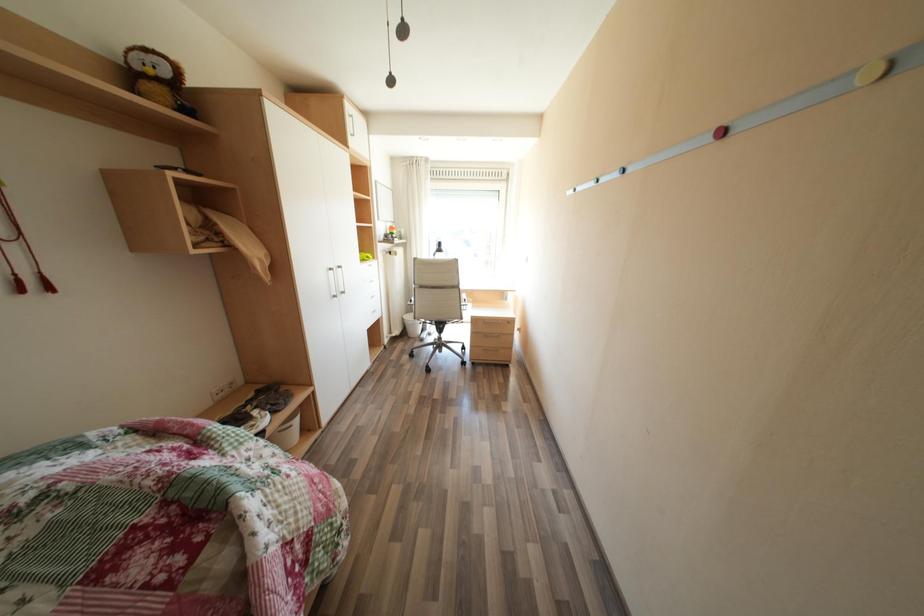
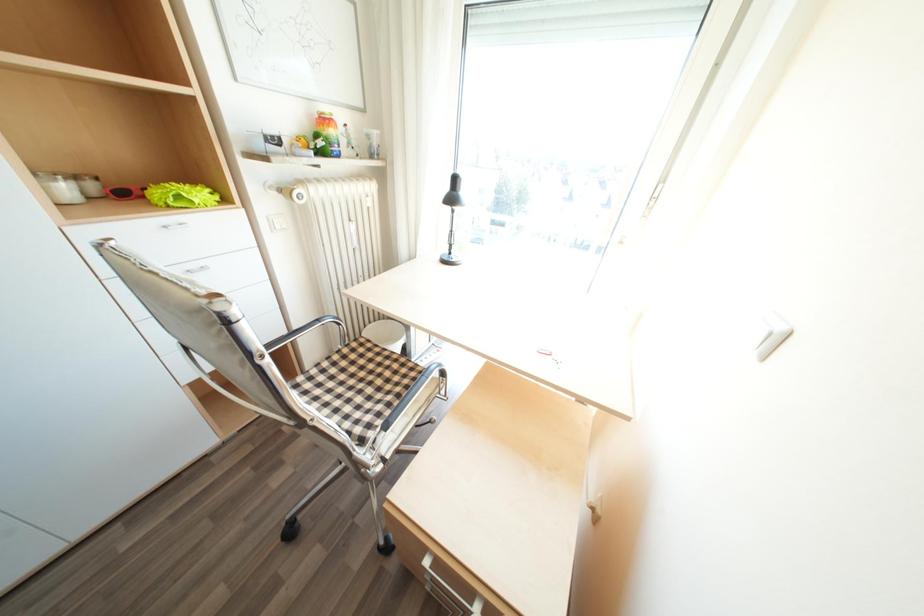
Question: Which direction would the cameraman need to move to produce the second image? Reply with the corresponding letter.

Choices:
 (A) Left
 (B) Right
 (C) Forward
 (D) Backward

Answer: (C)